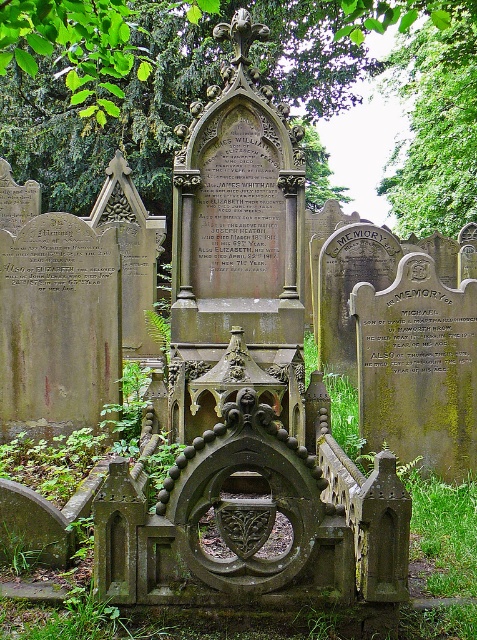
In the scene shown: Which is more to the right, green leafy tree at center or green leafy tree at upper center?

From the viewer's perspective, green leafy tree at upper center appears more on the right side.

This screenshot has width=477, height=640. I want to click on green leafy tree at center, so click(276, 99).